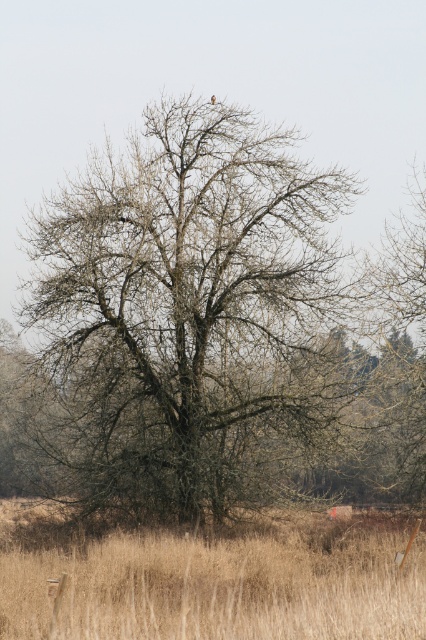
Between bare branches at center and brown dry grass at lower center, which one appears on the right side from the viewer's perspective?

brown dry grass at lower center

Based on the photo, between bare branches at center and brown dry grass at lower center, which one has more height?

Standing taller between the two is bare branches at center.

Locate an element on the screen. This screenshot has width=426, height=640. bare branches at center is located at coordinates (189, 317).

At what (x,y) coordinates should I click in order to perform the action: click on bare branches at center. Please return your answer as a coordinate pair (x, y). Looking at the image, I should click on (189, 317).